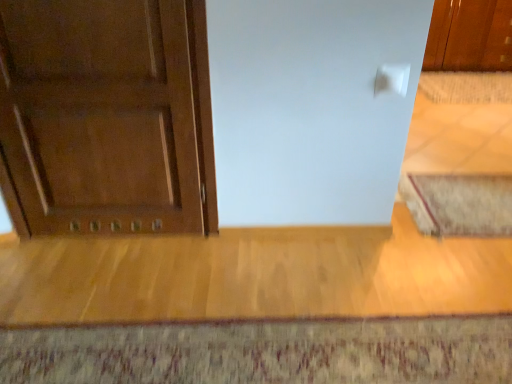
Where is `vacant area that is situated to the right of matte wood door at left`? The image size is (512, 384). vacant area that is situated to the right of matte wood door at left is located at coordinates (206, 260).